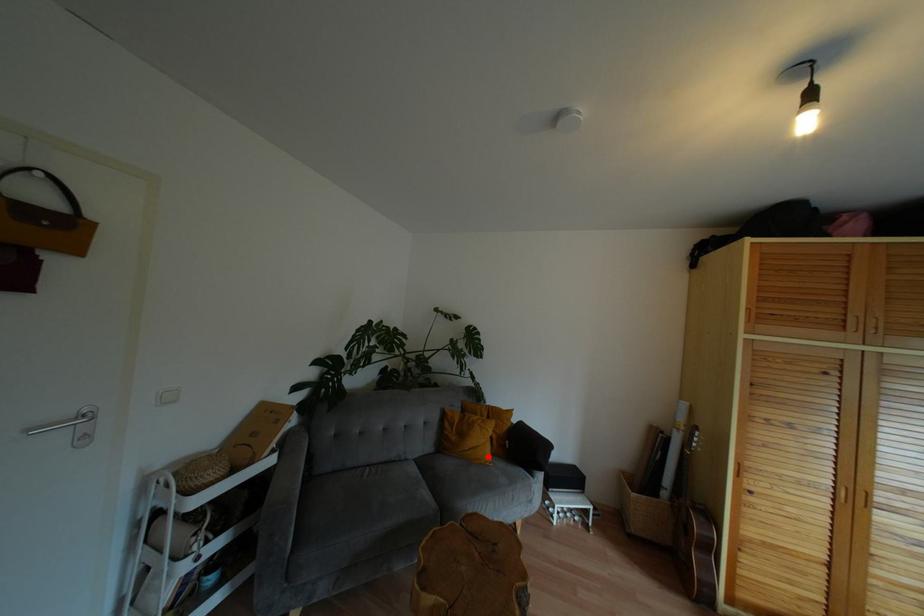
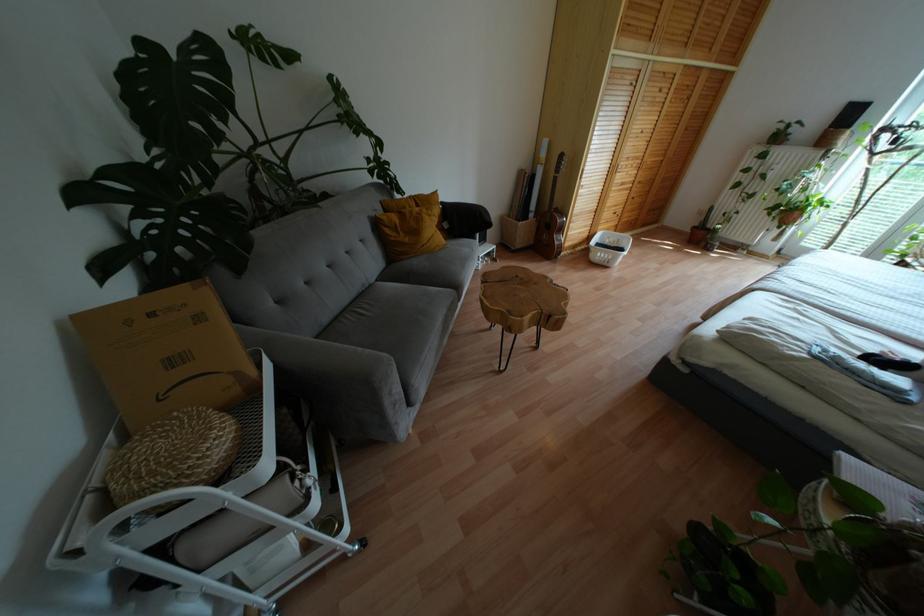
Question: A red point is marked in image1. In image2, is the corresponding 3D point closer to the camera or farther? Reply with the corresponding letter.

Choices:
 (A) The corresponding 3D point is closer.
 (B) The corresponding 3D point is farther.

Answer: (A)